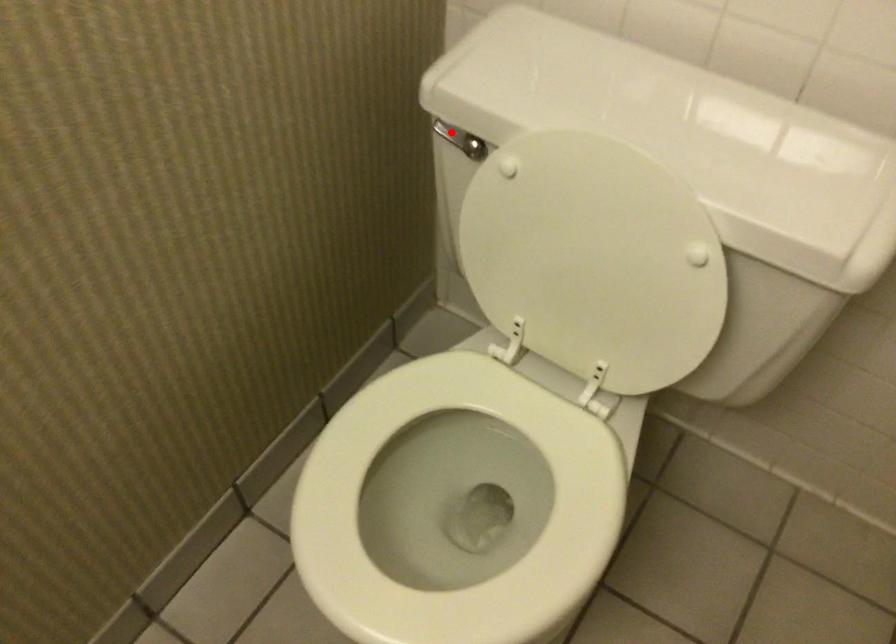
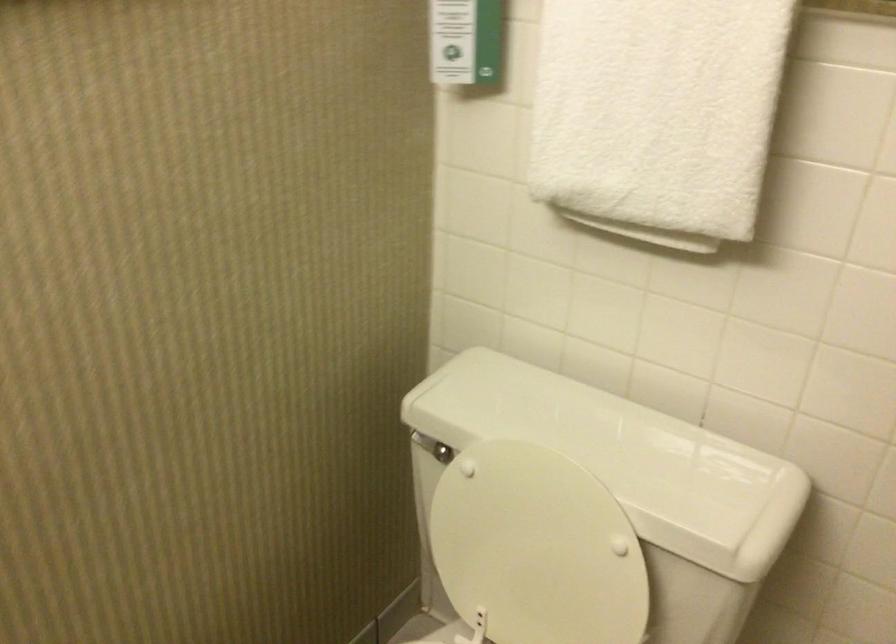
Question: I am providing you with two images of the same scene from different viewpoints. Image1 has a red point marked. In image2, the corresponding 3D location appears at what relative position? Reply with the corresponding letter.

Choices:
 (A) Closer
 (B) Farther

Answer: (B)